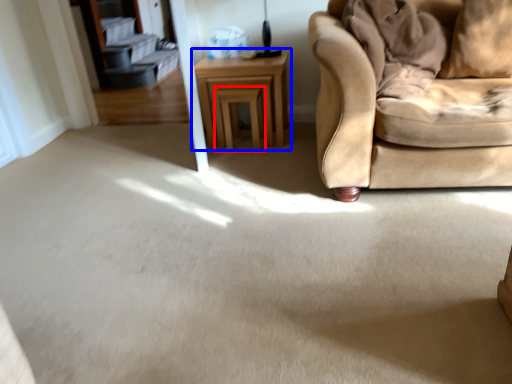
Question: Which point is further to the camera, stool (highlighted by a red box) or table (highlighted by a blue box)?

Choices:
 (A) stool
 (B) table

Answer: (A)